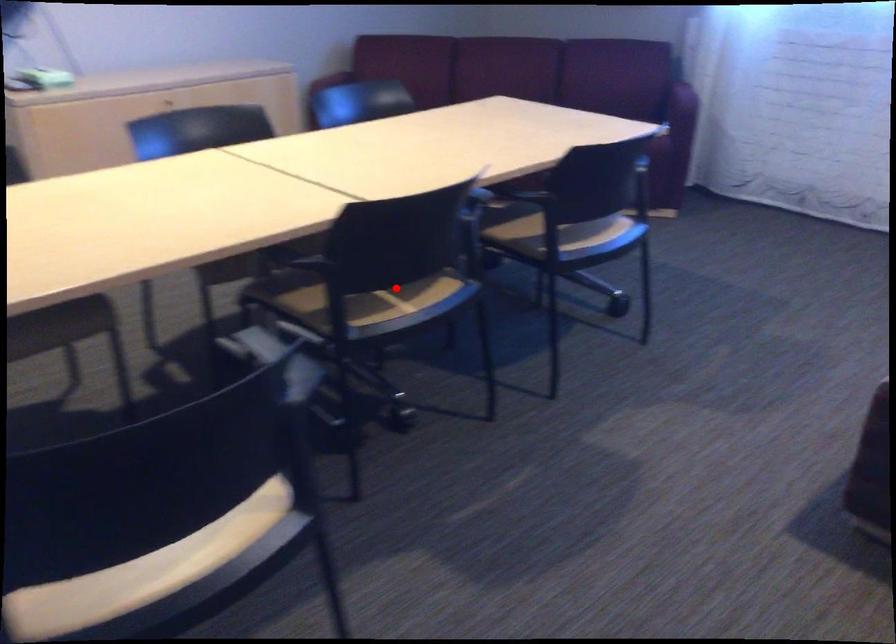
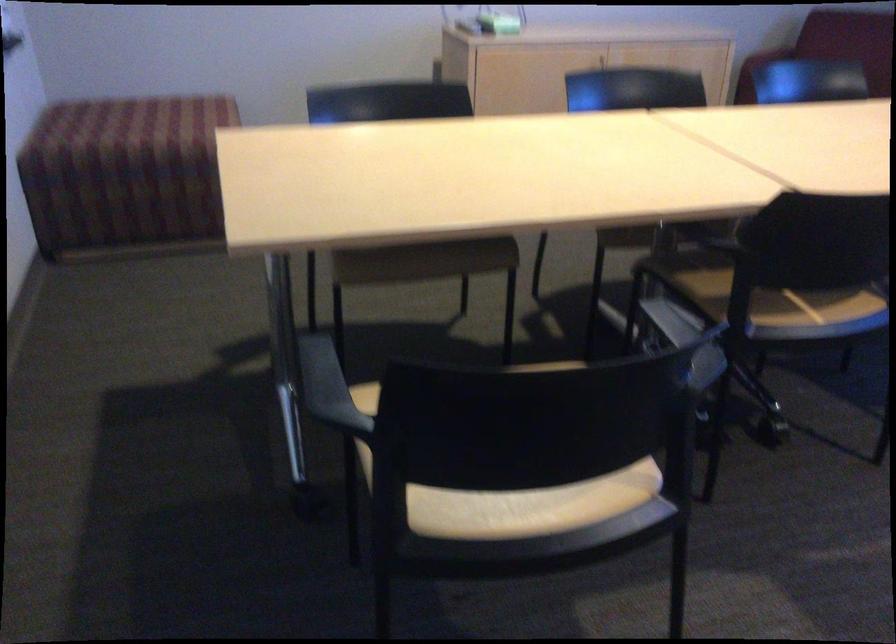
Find the pixel in the second image that matches the highlighted location in the first image.

(812, 301)